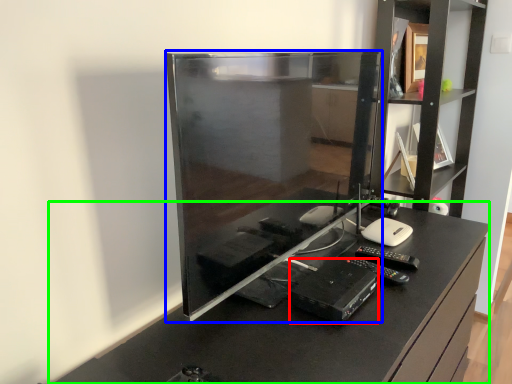
Question: Based on their relative distances, which object is nearer to equipment (highlighted by a red box)? Choose from desktop computer (highlighted by a blue box) and furniture (highlighted by a green box).

Choices:
 (A) desktop computer
 (B) furniture

Answer: (B)